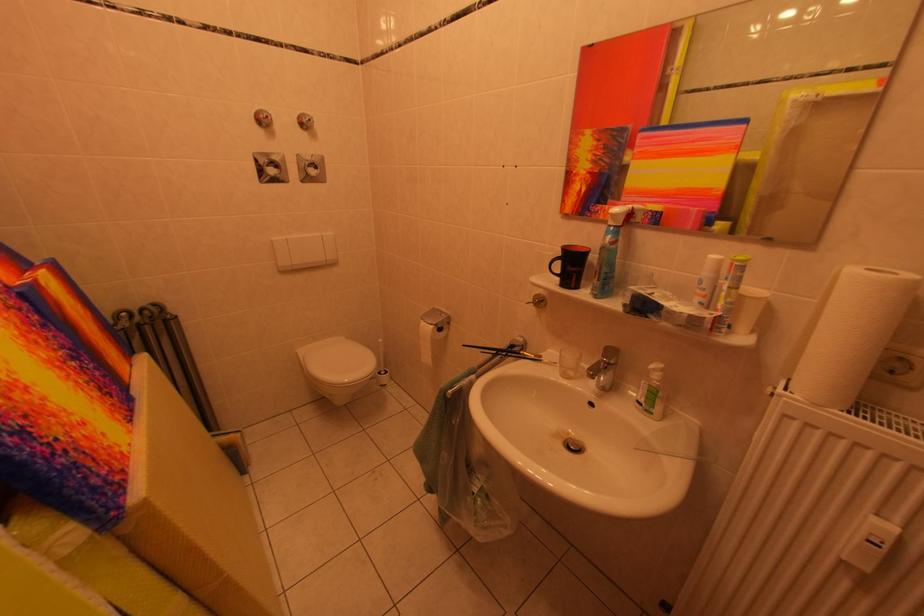
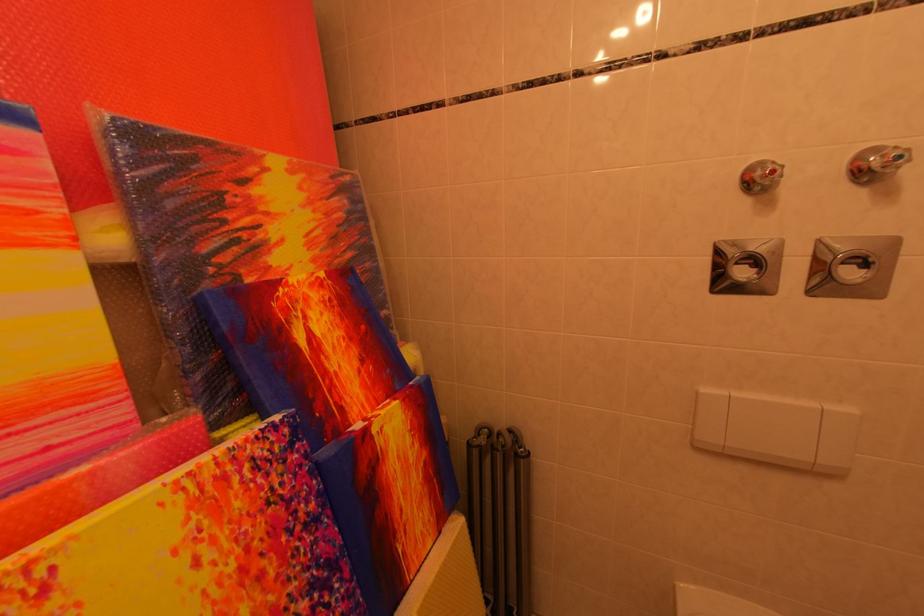
The point at (276,120) is marked in the first image. Where is the corresponding point in the second image?

(782, 176)